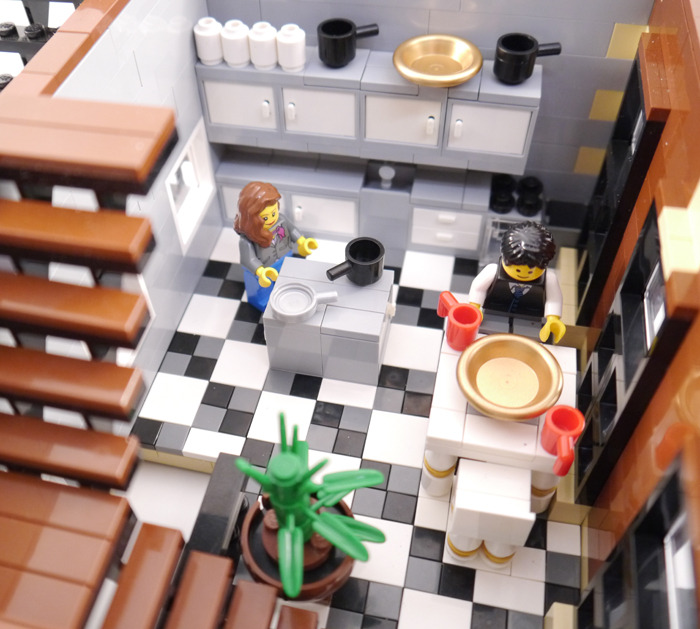
Find the location of a particular element. The height and width of the screenshot is (629, 700). red mug is located at coordinates (566, 446).